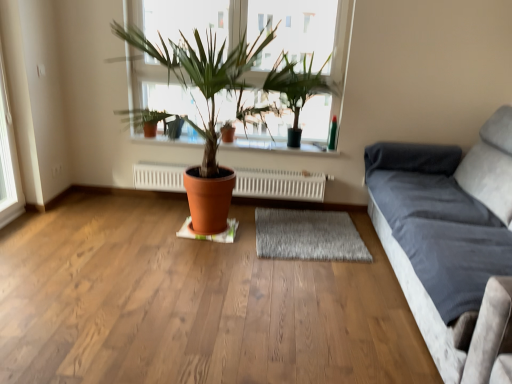
Identify the location of vacant space in white plastic window frame at left (from a real-world perspective). This screenshot has width=512, height=384. (12, 219).